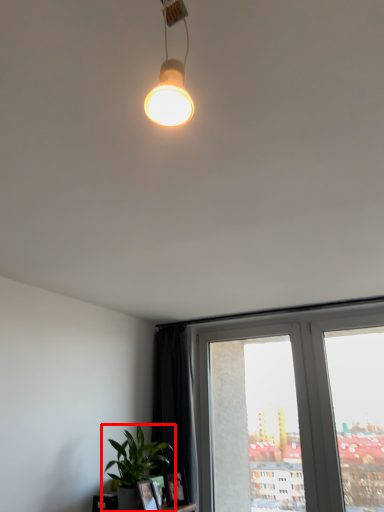
Question: Observing the image, what is the correct spatial positioning of houseplant (annotated by the red box) in reference to window frame?

Choices:
 (A) left
 (B) right

Answer: (A)